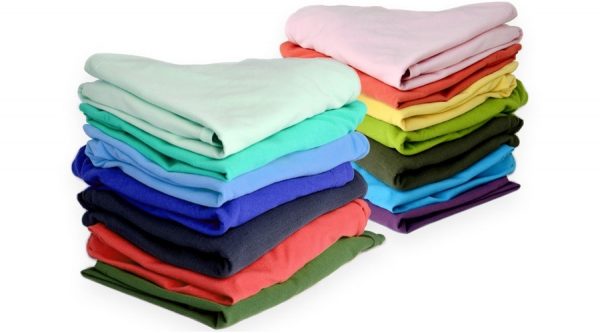
The image size is (600, 333). Find the location of `clothes in the middle of each stack`. clothes in the middle of each stack is located at coordinates (266, 149), (276, 178), (275, 192), (279, 222), (284, 257), (410, 197), (421, 166), (424, 133), (432, 112), (433, 89).